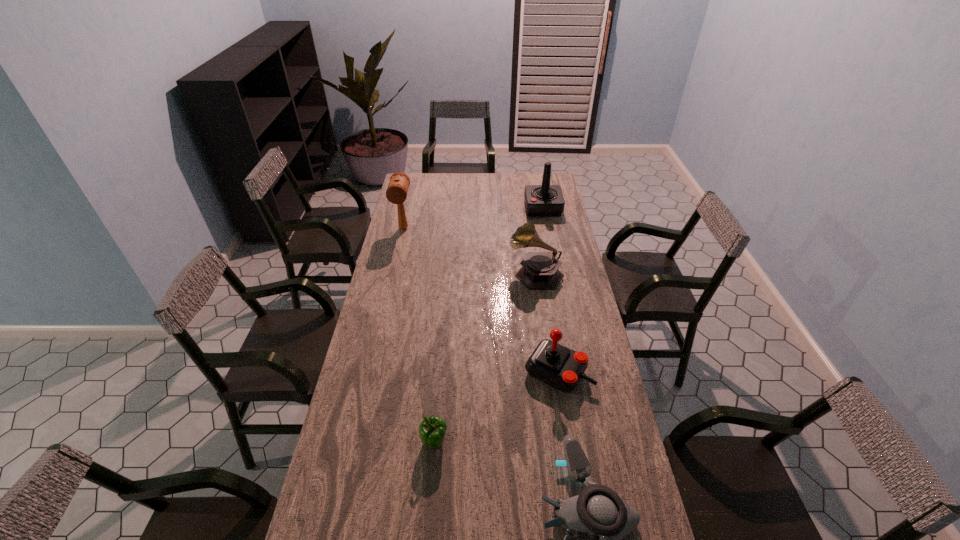
This screenshot has height=540, width=960. In order to click on the leftmost object in this screenshot , I will do `click(396, 193)`.

The image size is (960, 540). Identify the location of mallet. (396, 193).

This screenshot has height=540, width=960. I want to click on the farthest object, so click(541, 200).

Locate an element on the screen. Image resolution: width=960 pixels, height=540 pixels. the farther joystick is located at coordinates (541, 200).

Locate an element on the screen. The image size is (960, 540). phonograph record is located at coordinates (539, 271).

This screenshot has width=960, height=540. Identify the location of the shorter joystick. (554, 364).

Where is `the nearer joystick`? This screenshot has height=540, width=960. the nearer joystick is located at coordinates (554, 364).

Locate an element on the screen. The image size is (960, 540). the fifth tallest object is located at coordinates (432, 430).

The image size is (960, 540). I want to click on the second object from left to right, so click(x=432, y=430).

Where is `free space located 0.220m on the strike surface of the second farthest object`? free space located 0.220m on the strike surface of the second farthest object is located at coordinates (395, 266).